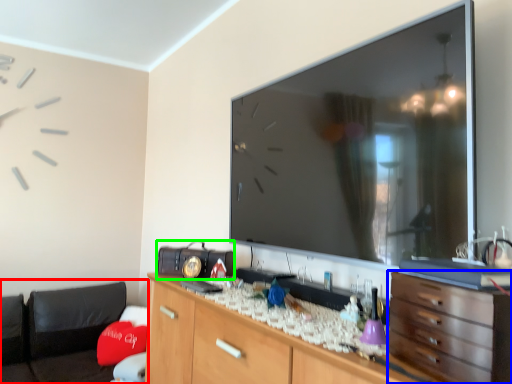
Question: Which object is the closest to the bean bag chair (highlighted by a red box)? Choose among these: chest of drawers (highlighted by a blue box) or radio (highlighted by a green box).

Choices:
 (A) chest of drawers
 (B) radio

Answer: (B)